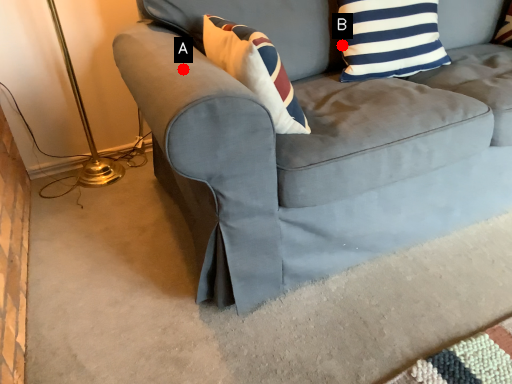
Question: Two points are circled on the image, labeled by A and B beside each circle. Which point is closer to the camera taking this photo?

Choices:
 (A) A is closer
 (B) B is closer

Answer: (A)